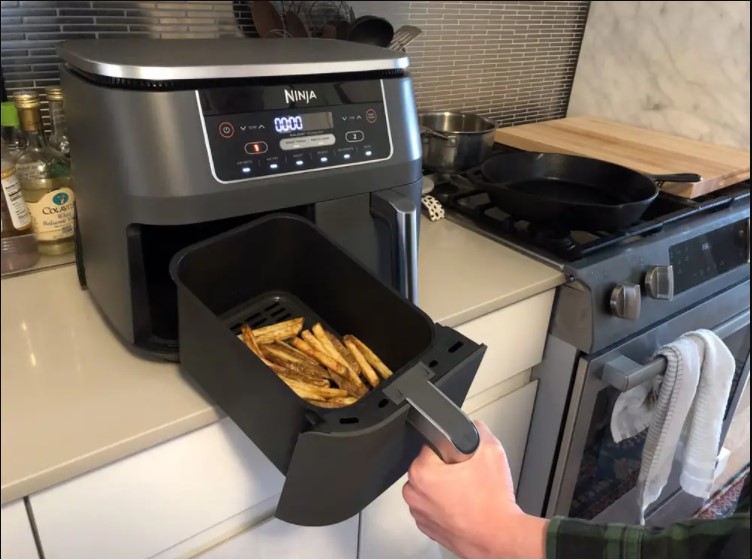
This screenshot has width=752, height=560. I want to click on air fryer basket, so click(x=247, y=401).